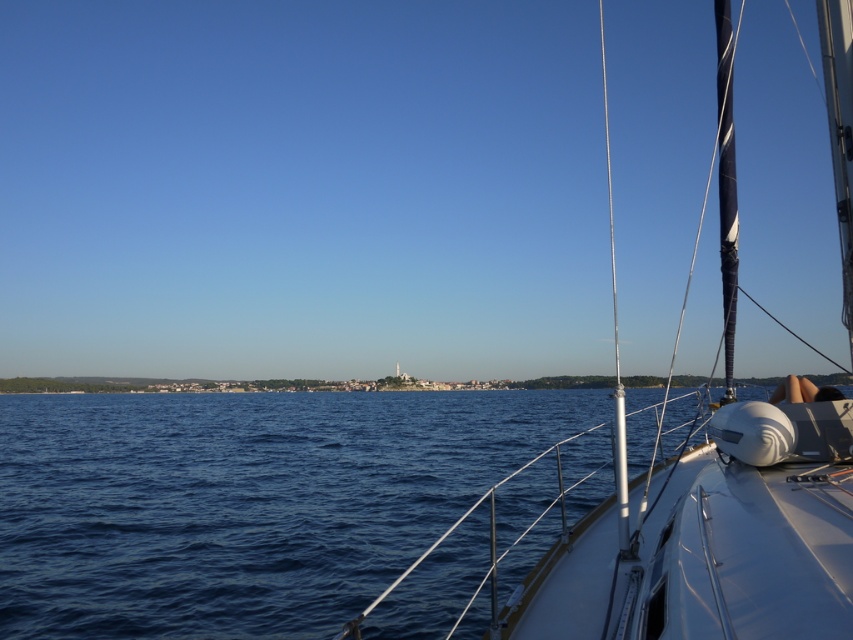
You are standing on the deck of the white glossy sailboat at center. You want to throw a lifebuoy to someone in the water who is 10 feet away from the boat. Can you reach them with the lifebuoy from your current position?

The white glossy sailboat at center and viewer are 7.63 feet apart. Since the person in the water is 10 feet away from the boat, the distance between you and the person is 10 feet minus your distance from the boat, which would be 10 feet minus 7.63 feet equals 2.37 feet. Therefore, you can easily reach the person with the lifebuoy.

Looking at this image, you are standing on the deck of the white glossy sailboat at center. Looking towards the horizon, which direction would you face to see the boat itself reflected in the water?

Since the white glossy sailboat at center is positioned at point coordinates (712, 536), you should look directly behind you to see its reflection in the water.